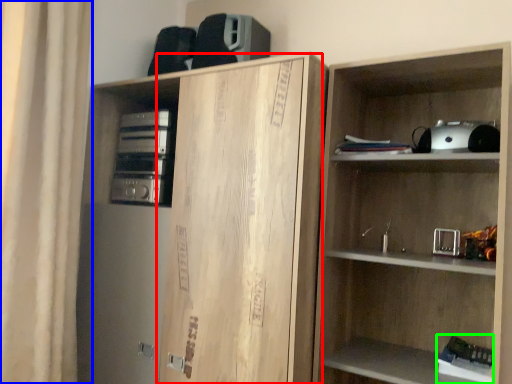
Question: Based on their relative distances, which object is farther from cabinetry (highlighted by a red box)? Choose from curtain (highlighted by a blue box) and book (highlighted by a green box).

Choices:
 (A) curtain
 (B) book

Answer: (B)